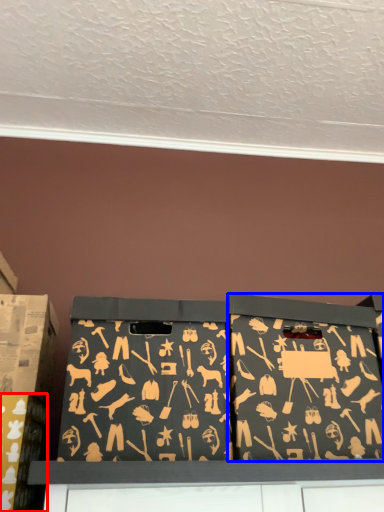
Question: Which point is further to the camera, box (highlighted by a red box) or box (highlighted by a blue box)?

Choices:
 (A) box
 (B) box

Answer: (A)